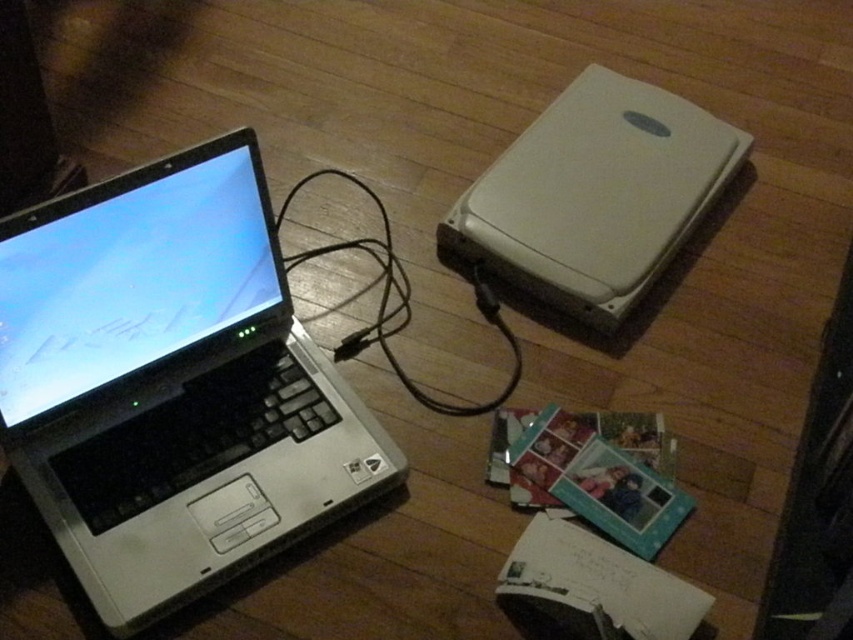
You are a technician trying to connect a device to a laptop. You have a cable that is 8 inches long. Based on the image, will the black cable at center be long enough to connect the silver metallic laptop at left to the device on the floor?

The silver metallic laptop at left and black cable at center are 8.47 inches apart from each other. Since the cable is only 8 inches long, it is 0.47 inches shorter than needed. Therefore, the black cable at center will not be long enough to connect the silver metallic laptop at left to the device on the floor.

You are a technician trying to troubleshoot a connection issue between the silver metallic laptop at left and the black cable at center. Based on the scene, can you determine if the laptop is physically connected to the cable?

The silver metallic laptop at left is in front of the black cable at center, meaning the cable is behind the laptop. Since the cable is connected from the laptop to a device on the floor, the laptop is physically connected to the black cable at center.

You are trying to unplug the black cable at center from the silver metallic laptop at left. Based on the scene, where should you look for the cable connection on the laptop?

The silver metallic laptop at left is below the black cable at center, so the cable connection is likely located on the upper side of the laptop.